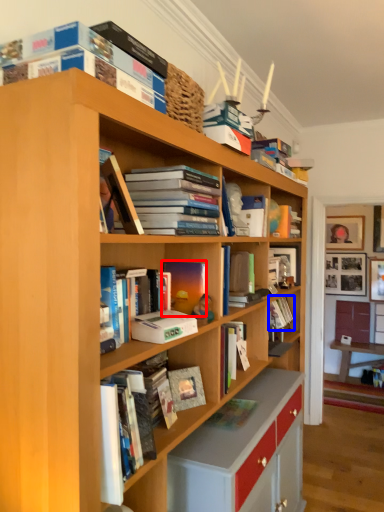
Question: Among these objects, which one is farthest to the camera, book (highlighted by a red box) or book (highlighted by a blue box)?

Choices:
 (A) book
 (B) book

Answer: (B)